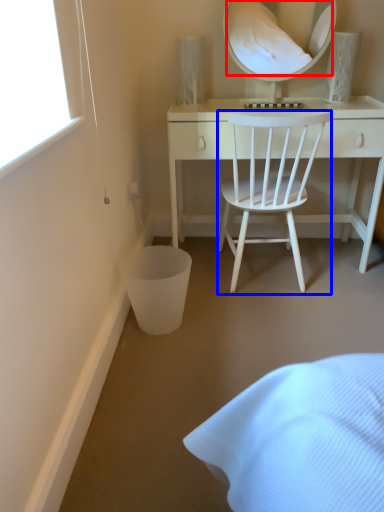
Question: Which object appears closest to the camera in this image, mirror (highlighted by a red box) or chair (highlighted by a blue box)?

Choices:
 (A) mirror
 (B) chair

Answer: (B)